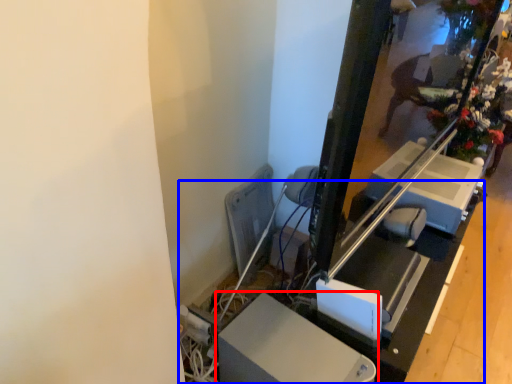
Question: Which of the following is the farthest to the observer, furniture (highlighted by a red box) or table (highlighted by a blue box)?

Choices:
 (A) furniture
 (B) table

Answer: (B)